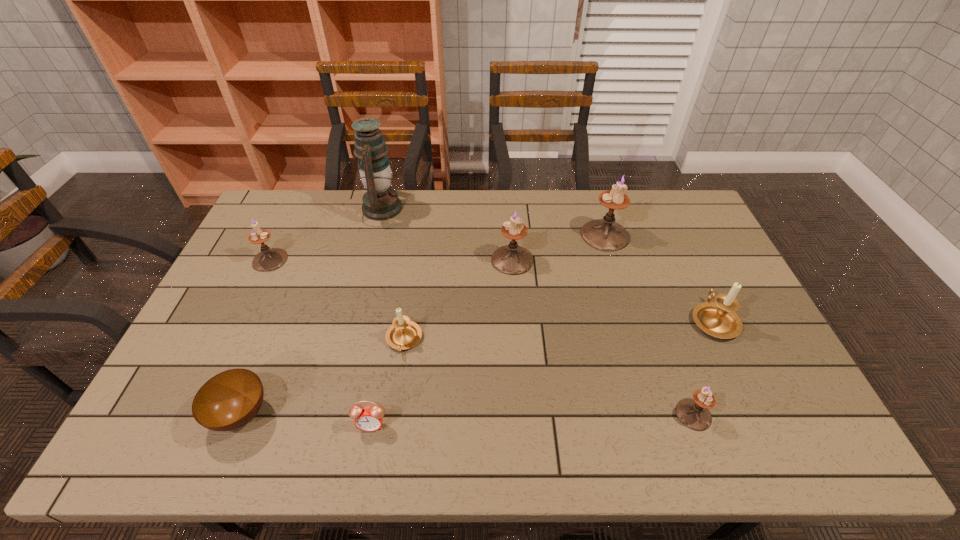
You are a GUI agent. You are given a task and a screenshot of the screen. Output one action in this format:
    pyautogui.click(x=<x>, y=<y>)
    Task: Click on the left beige candle holder
    The width and height of the screenshot is (960, 540).
    Given the screenshot: What is the action you would take?
    pyautogui.click(x=403, y=334)

The image size is (960, 540). What are the coordinates of `the smaller beige candle holder` in the screenshot? It's located at (403, 334).

Where is `the nearest purple candle holder`? This screenshot has width=960, height=540. the nearest purple candle holder is located at coordinates (693, 413).

You are a GUI agent. You are given a task and a screenshot of the screen. Output one action in this format:
    pyautogui.click(x=<x>, y=<y>)
    Task: Click on the smallest purple candle holder
    The height and width of the screenshot is (540, 960).
    Given the screenshot: What is the action you would take?
    pyautogui.click(x=693, y=413)

Image resolution: width=960 pixels, height=540 pixels. What are the coordinates of `alarm clock` in the screenshot? It's located at (369, 418).

Where is `bowl`? bowl is located at coordinates (231, 399).

Locate an element on the screen. The width and height of the screenshot is (960, 540). free point located 0.330m on the left of the rust oil lamp is located at coordinates (269, 208).

Where is `vacant position located on the right of the biggest purple candle holder`? This screenshot has height=540, width=960. vacant position located on the right of the biggest purple candle holder is located at coordinates (679, 235).

Where is `vacant area situated on the right of the seventh shortest object`? Image resolution: width=960 pixels, height=540 pixels. vacant area situated on the right of the seventh shortest object is located at coordinates (625, 260).

Where is `vacant space located on the back of the leftmost purple candle holder`? Image resolution: width=960 pixels, height=540 pixels. vacant space located on the back of the leftmost purple candle holder is located at coordinates pyautogui.click(x=286, y=226).